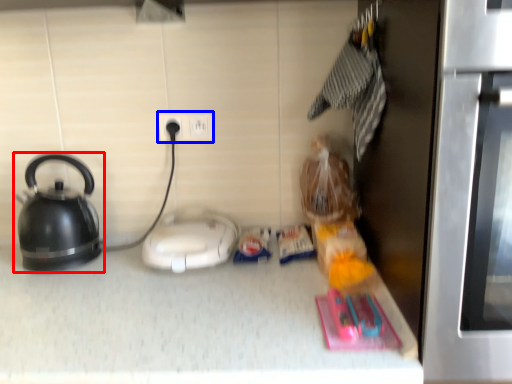
Question: Which of the following is the farthest to the observer, kettle (highlighted by a red box) or electric outlet (highlighted by a blue box)?

Choices:
 (A) kettle
 (B) electric outlet

Answer: (B)